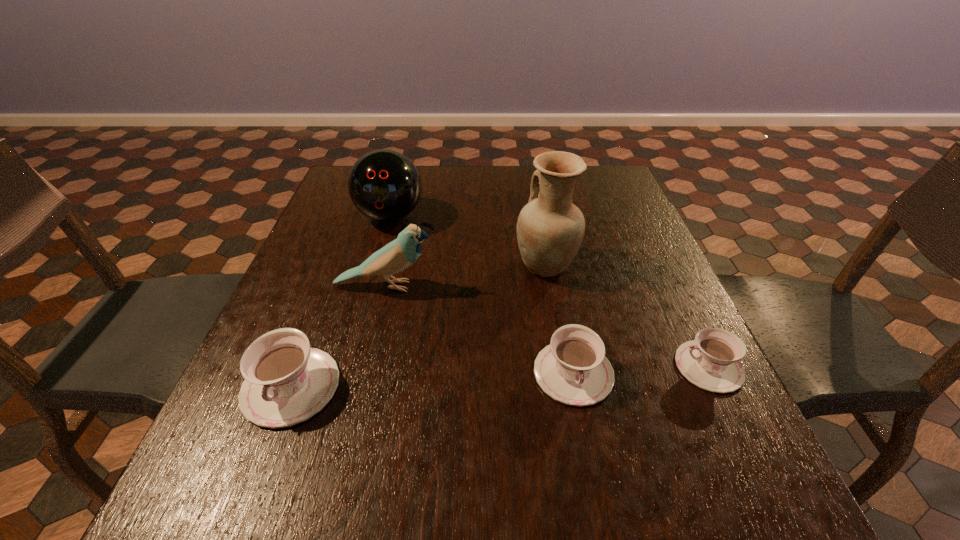
The height and width of the screenshot is (540, 960). In order to click on object that is at the near left corner in this screenshot , I will do `click(286, 382)`.

Identify the location of vacant space at the far edge of the desktop. (445, 183).

Where is `blank space at the left edge of the desktop`? blank space at the left edge of the desktop is located at coordinates (367, 235).

The width and height of the screenshot is (960, 540). In order to click on free point at the right edge in this screenshot , I will do `click(663, 390)`.

In the image, there is a desktop. What are the coordinates of `free region at the far left corner` in the screenshot? It's located at pos(333,205).

The height and width of the screenshot is (540, 960). In the image, there is a desktop. Find the location of `free space at the far right corner`. free space at the far right corner is located at coordinates (582, 189).

Find the location of a particular element. The height and width of the screenshot is (540, 960). vacant area between the shortest object and the second shortest object is located at coordinates (641, 370).

At what (x,y) coordinates should I click in order to perform the action: click on free point between the rightmost object and the second shortest teacup. Please return your answer as a coordinate pair (x, y). This screenshot has height=540, width=960. Looking at the image, I should click on (641, 370).

Locate an element on the screen. The width and height of the screenshot is (960, 540). free point between the pottery and the bowling ball is located at coordinates [x=468, y=241].

Identify the location of unoccupied area between the bowling ball and the shortest object. (549, 292).